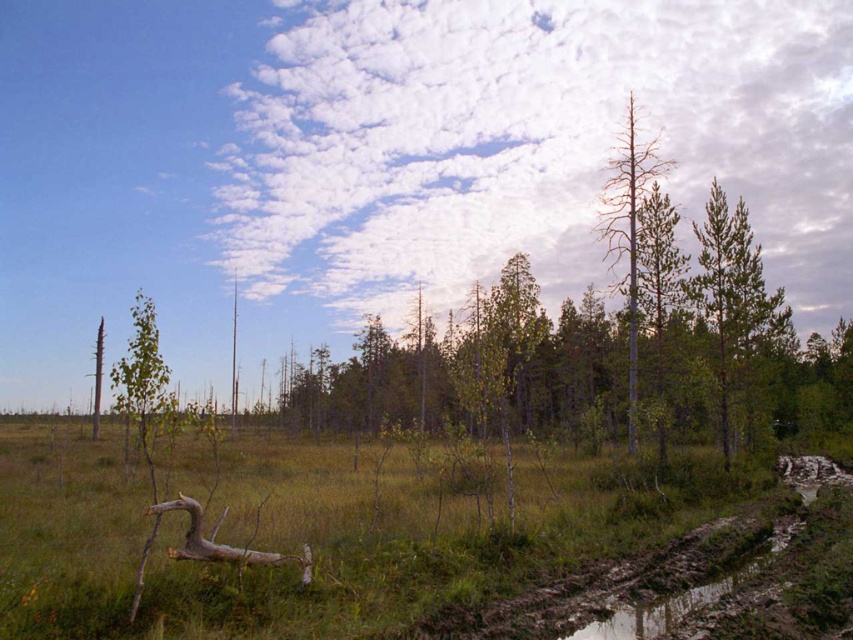
You are a hiker navigating through the wetland area and need to identify the shortest tree on the right side. Which tree should you choose between the green matte tree at right and the brown bark tree at right?

The green matte tree at right is smaller than the brown bark tree at right, so you should choose the green matte tree at right as the shortest one on the right side.